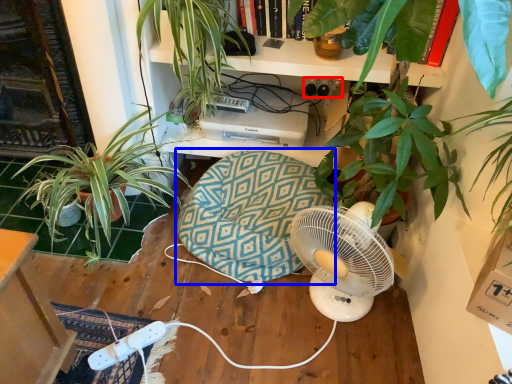
Question: Which object is further to the camera taking this photo, plug (highlighted by a red box) or swivel chair (highlighted by a blue box)?

Choices:
 (A) plug
 (B) swivel chair

Answer: (A)